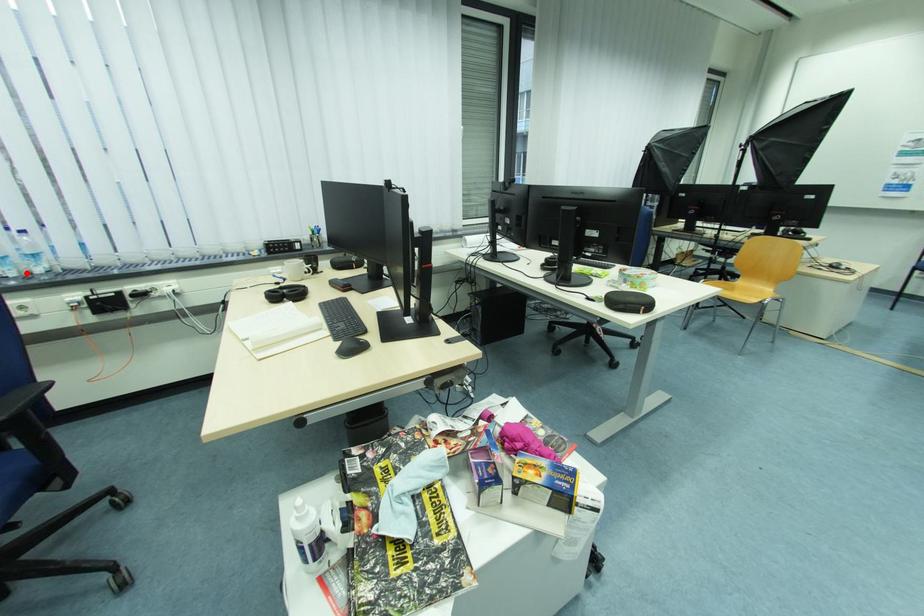
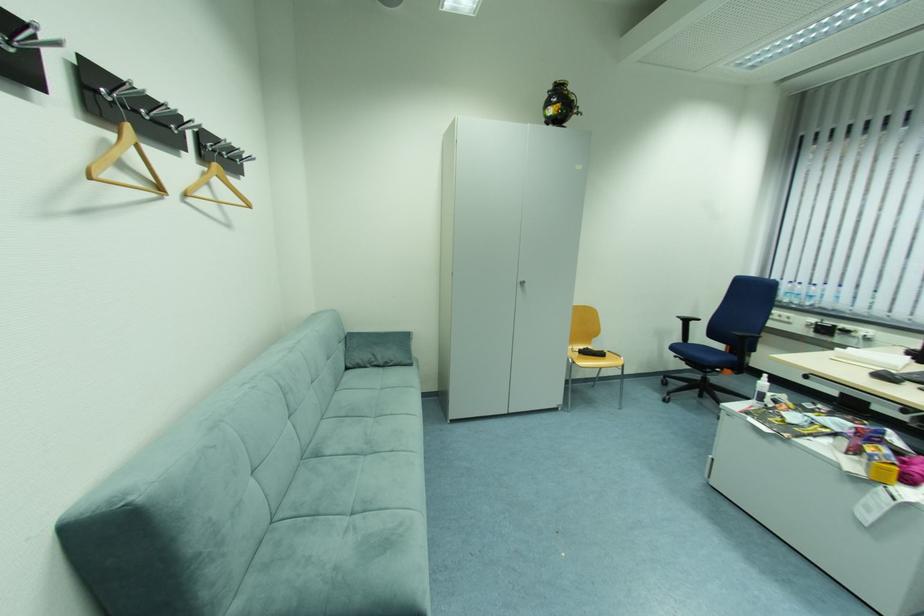
Question: I am providing you with two images of the same scene from different viewpoints. A red point is shown in image1. For the corresponding object point in image2, is it positioned nearer or farther from the camera?

Choices:
 (A) Nearer
 (B) Farther

Answer: (A)